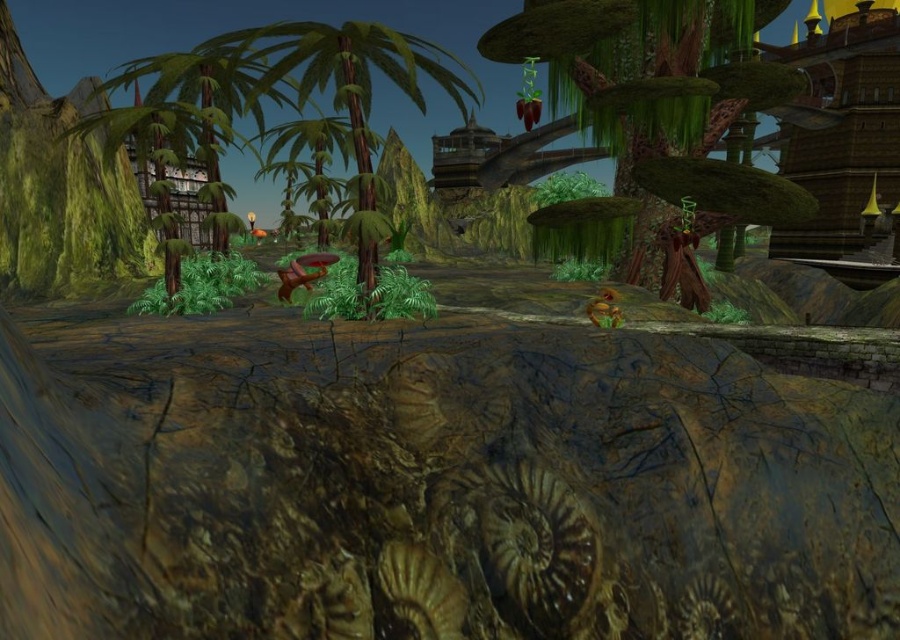
You are standing at the point marked by the coordinates (662, 113) in this scene. Looking around, you see a green mossy tree at center. What direction should you face to see the green mossy tree at center?

Since the point (662, 113) is marked as the green mossy tree at center, you are already facing the tree directly in front of you.

You are a character in this game needing to climb a tree to reach a high platform. Which tree would you choose between the green mossy tree at center and the green matte palm tree at center, and why?

You should choose the green matte palm tree at center because it is taller than the green mossy tree at center, making it easier to reach the high platform.